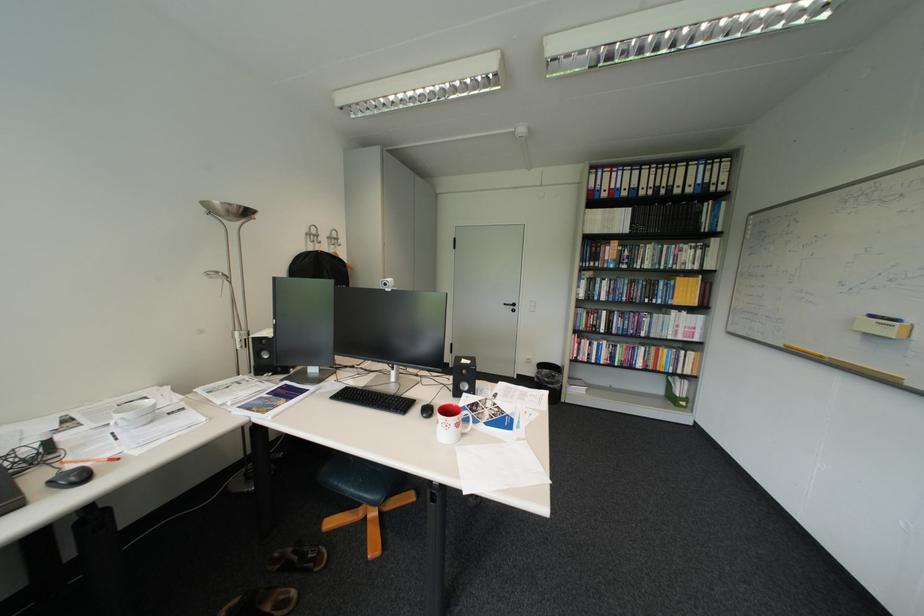
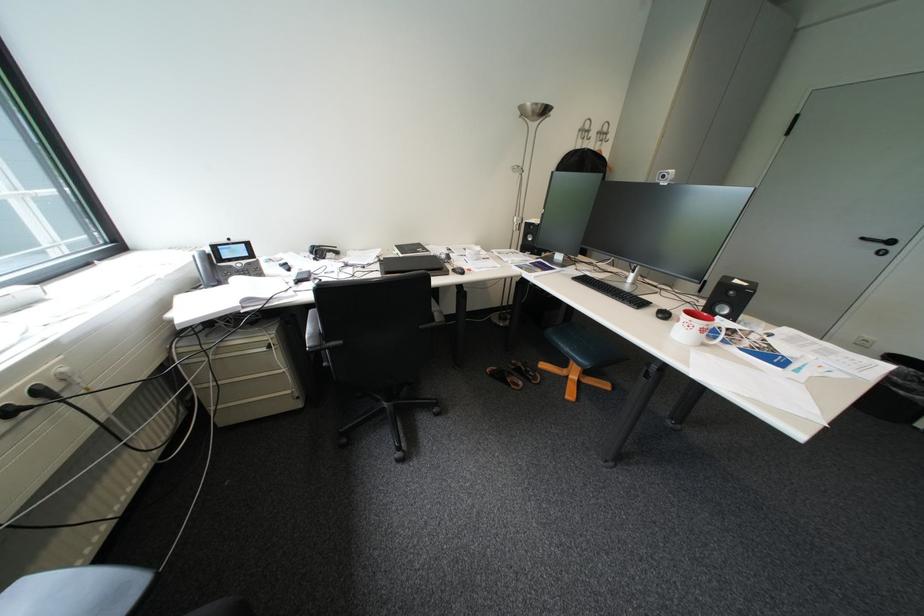
Find the pixel in the second image that matches point (429, 411) in the first image.

(663, 310)